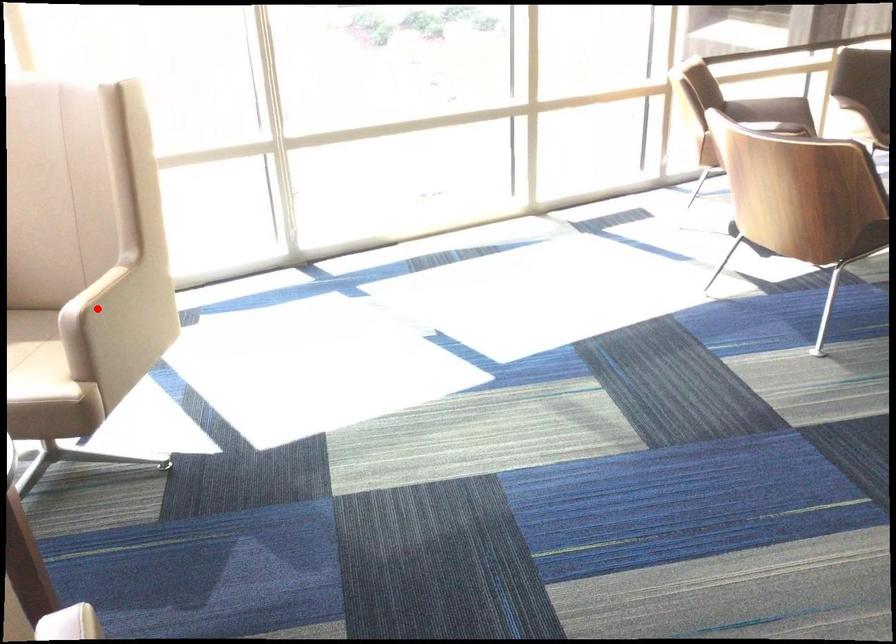
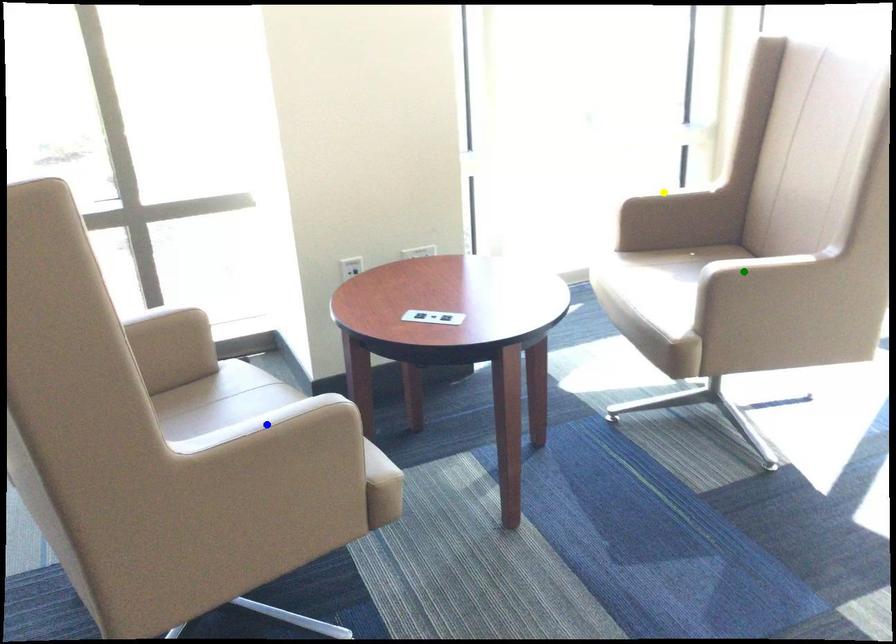
Question: I am providing you with two images of the same scene from different viewpoints. A red point is marked on the first image. You are given multiple points on the second image. Which point in image 2 represents the same 3d spot as the red point in image 1?

Choices:
 (A) yellow point
 (B) green point
 (C) blue point

Answer: (B)